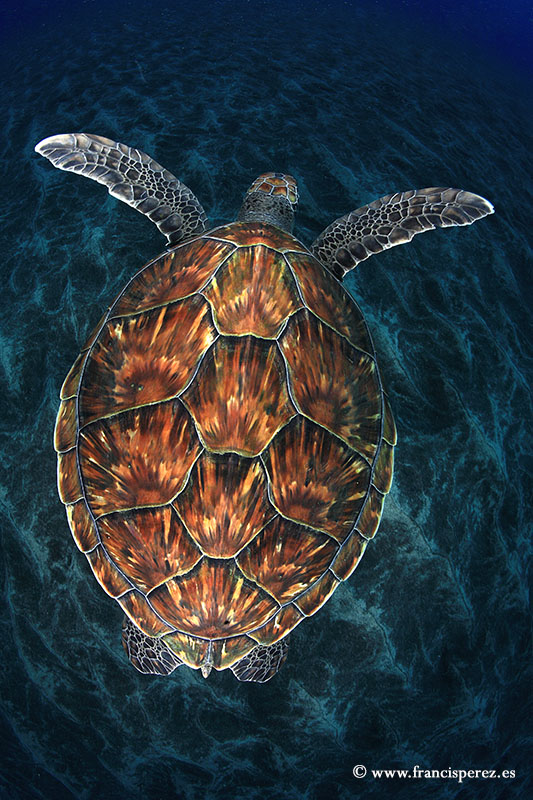
Where is `shelf back left`? The image size is (533, 800). shelf back left is located at coordinates (175, 658).